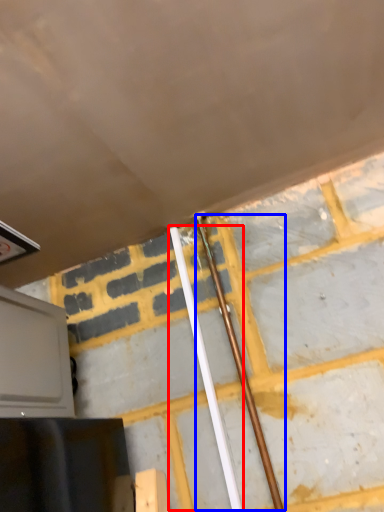
Question: Which point is further to the camera, beam (highlighted by a red box) or beam (highlighted by a blue box)?

Choices:
 (A) beam
 (B) beam

Answer: (A)